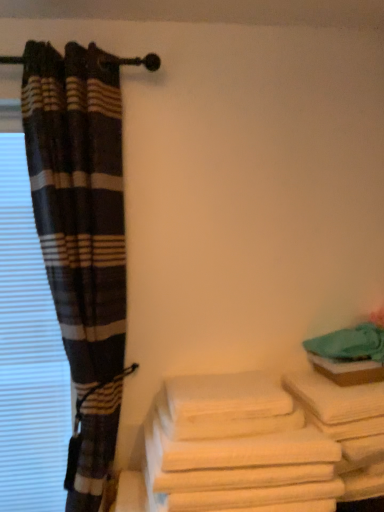
Question: From a real-world perspective, is white blinds at left above or below white cotton towels at lower right?

Choices:
 (A) below
 (B) above

Answer: (B)

Question: From the image's perspective, relative to white cotton towels at lower right, is white blinds at left above or below?

Choices:
 (A) below
 (B) above

Answer: (B)

Question: Which object is positioned farthest from the white cotton towels at lower right?

Choices:
 (A) plaid fabric curtain at left
 (B) white cotton bath towel at lower right
 (C) white blinds at left

Answer: (C)

Question: Which object is the closest to the plaid fabric curtain at left?

Choices:
 (A) white cotton bath towel at lower right
 (B) white cotton towels at lower right
 (C) white blinds at left

Answer: (C)